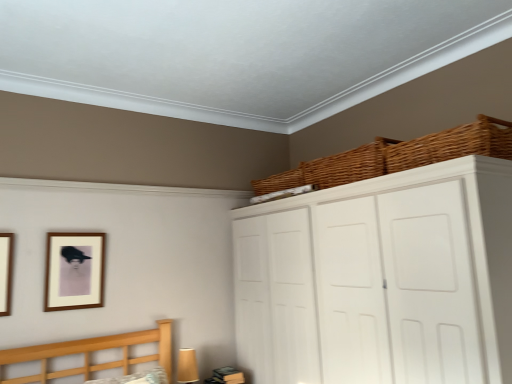
Question: Choose the correct answer: Is white matte cupboard at upper right inside wooden picture frame at left, which appears as the 2th picture frame when viewed from the right, or outside it?

Choices:
 (A) outside
 (B) inside

Answer: (A)

Question: From a real-world perspective, is white matte cupboard at upper right positioned above or below wooden picture frame at left, which appears as the 2th picture frame when viewed from the right?

Choices:
 (A) above
 (B) below

Answer: (B)

Question: Considering the real-world distances, which object is farthest from the white matte cupboard at upper right?

Choices:
 (A) woven brown basket at upper center, which is counted as the 3th basket, starting from the front
 (B) matte brown picture frame at upper left, which is the 1th picture frame in right-to-left order
 (C) woven brown basket at upper center, which is the second basket from front to back
 (D) woven brown basket at upper right, arranged as the third basket when viewed from the back
 (E) wooden picture frame at left, acting as the second picture frame starting from the back

Answer: (E)

Question: Which is farther from the woven brown basket at upper center, which is counted as the 3th basket, starting from the front?

Choices:
 (A) woven brown basket at upper center, which is the second basket from front to back
 (B) wooden picture frame at left, acting as the second picture frame starting from the back
 (C) woven brown basket at upper right, arranged as the third basket when viewed from the back
 (D) matte brown picture frame at upper left, which appears as the second picture frame when viewed from the left
 (E) white matte cupboard at upper right

Answer: (B)